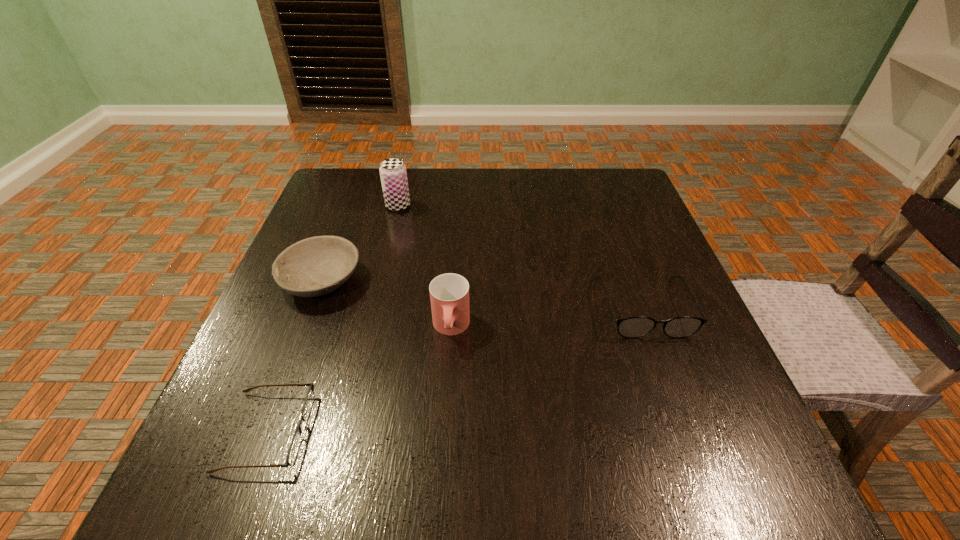
Where is `the third object from left to right`? the third object from left to right is located at coordinates (393, 174).

The image size is (960, 540). Identify the location of beer can. (393, 174).

Locate an element on the screen. the second tallest object is located at coordinates (449, 293).

Where is `the fourth object from left to right`? The image size is (960, 540). the fourth object from left to right is located at coordinates (449, 293).

I want to click on the right spectacles, so click(638, 326).

Locate an element on the screen. The width and height of the screenshot is (960, 540). the farther spectacles is located at coordinates (638, 326).

Locate an element on the screen. Image resolution: width=960 pixels, height=540 pixels. bowl is located at coordinates (315, 266).

Where is `the left spectacles`? The image size is (960, 540). the left spectacles is located at coordinates (295, 444).

Locate an element on the screen. The height and width of the screenshot is (540, 960). the shorter spectacles is located at coordinates (295, 444).

The height and width of the screenshot is (540, 960). I want to click on blank area located 0.190m on the front of the third object from right to left, so click(x=384, y=263).